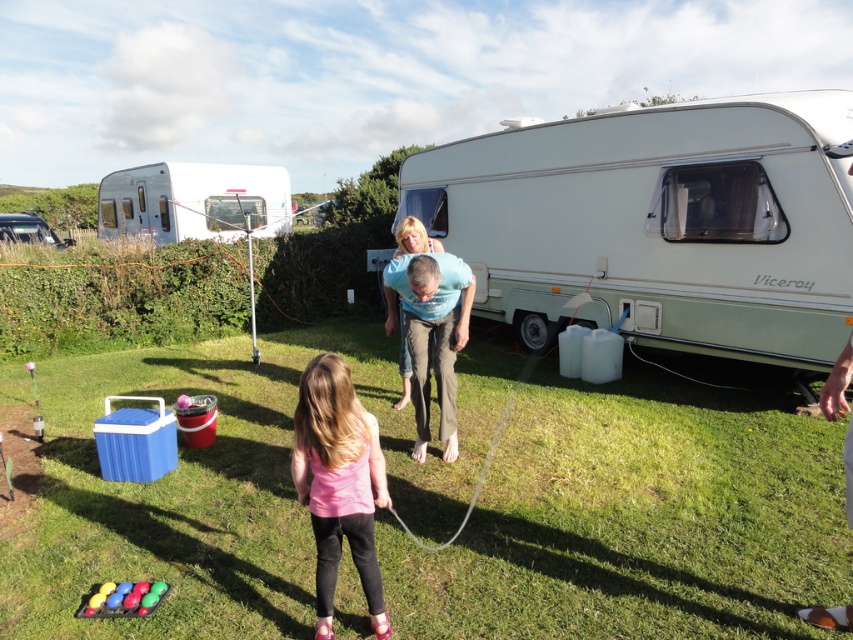
Is point (546, 145) positioned behind point (10, 220)?

That is False.

Can you confirm if white plastic recreational vehicle at center is smaller than metallic silver trailer at upper left?

Indeed, white plastic recreational vehicle at center has a smaller size compared to metallic silver trailer at upper left.

Between point (486, 225) and point (21, 236), which one is positioned in front?

Point (486, 225) is more forward.

At what (x,y) coordinates should I click in order to perform the action: click on white plastic recreational vehicle at center. Please return your answer as a coordinate pair (x, y). This screenshot has height=640, width=853. Looking at the image, I should click on [659, 224].

Between point (334, 579) and point (10, 240), which one is positioned behind?

Point (10, 240)

Does pink matte tank top at center have a smaller size compared to metallic silver trailer at upper left?

Indeed, pink matte tank top at center has a smaller size compared to metallic silver trailer at upper left.

Between point (321, 355) and point (3, 227), which one is positioned behind?

Positioned behind is point (3, 227).

Locate an element on the screen. pink matte tank top at center is located at coordinates (338, 483).

Can you confirm if white plastic recreational vehicle at upper center is positioned above blue cotton shirt at center?

Indeed, white plastic recreational vehicle at upper center is positioned over blue cotton shirt at center.

Is point (105, 179) farther from camera compared to point (450, 316)?

Yes, point (105, 179) is farther from viewer.

Image resolution: width=853 pixels, height=640 pixels. Find the location of `white plastic recreational vehicle at upper center`. white plastic recreational vehicle at upper center is located at coordinates (193, 202).